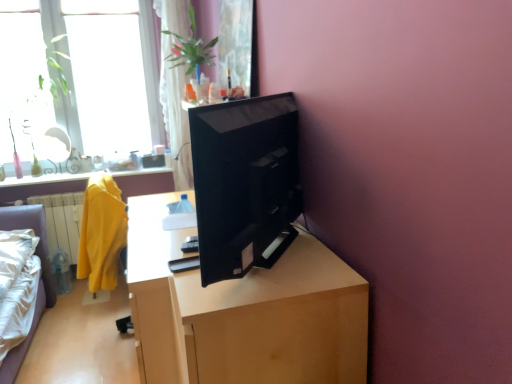
The height and width of the screenshot is (384, 512). What do you see at coordinates (244, 181) in the screenshot? I see `black glossy monitor at center` at bounding box center [244, 181].

Locate an element on the screen. yellow fabric at left is located at coordinates (62, 221).

This screenshot has width=512, height=384. What do you see at coordinates (62, 221) in the screenshot?
I see `yellow fabric at left` at bounding box center [62, 221].

This screenshot has height=384, width=512. Identify the location of matte yellow robe at left. (101, 233).

The height and width of the screenshot is (384, 512). What do you see at coordinates (243, 312) in the screenshot? I see `wooden desk at center` at bounding box center [243, 312].

This screenshot has height=384, width=512. Describe the element at coordinates (157, 81) in the screenshot. I see `transparent glass window at upper left` at that location.

Where is `black glossy monitor at center`? This screenshot has width=512, height=384. black glossy monitor at center is located at coordinates (244, 181).

From a real-world perspective, is white sheer curtain at upper center on top of matte yellow robe at left?

Indeed, from a real-world perspective, white sheer curtain at upper center stands above matte yellow robe at left.

How much distance is there between white sheer curtain at upper center and matte yellow robe at left?

The distance of white sheer curtain at upper center from matte yellow robe at left is 3.32 feet.

Is white sheer curtain at upper center shorter than matte yellow robe at left?

No.

In the scene shown: Can you confirm if white sheer curtain at upper center is wider than matte yellow robe at left?

No, white sheer curtain at upper center is not wider than matte yellow robe at left.

From a real-world perspective, between transparent glass window at upper left and white sheer curtain at upper center, who is vertically lower?

From a 3D spatial view, white sheer curtain at upper center is below.

Considering their positions, is transparent glass window at upper left located in front of or behind white sheer curtain at upper center?

transparent glass window at upper left is positioned farther from the viewer than white sheer curtain at upper center.

In terms of height, does transparent glass window at upper left look taller or shorter compared to white sheer curtain at upper center?

In the image, transparent glass window at upper left appears to be shorter than white sheer curtain at upper center.

From the image's perspective, is wooden desk at center above matte yellow robe at left?

No.

Based on the photo, would you say wooden desk at center is to the left or to the right of matte yellow robe at left in the picture?

Based on their positions, wooden desk at center is located to the right of matte yellow robe at left.

Consider the image. Is wooden desk at center directly adjacent to matte yellow robe at left?

No, wooden desk at center is not making contact with matte yellow robe at left.

Which of these two, wooden desk at center or matte yellow robe at left, stands taller?

wooden desk at center.

Who is smaller, matte yellow robe at left or black glossy monitor at center?

black glossy monitor at center.

Considering the positions of point (83, 273) and point (274, 132), is point (83, 273) closer or farther from the camera than point (274, 132)?

Point (83, 273) appears to be farther away from the viewer than point (274, 132).

Is matte yellow robe at left facing away from black glossy monitor at center?

No, matte yellow robe at left is not facing away from black glossy monitor at center.

From the image's perspective, relative to black glossy monitor at center, is matte yellow robe at left above or below?

Clearly, from the image's perspective, matte yellow robe at left is below black glossy monitor at center.

Does black glossy monitor at center appear on the left side of white sheer curtain at upper center?

In fact, black glossy monitor at center is to the right of white sheer curtain at upper center.

From a real-world perspective, is black glossy monitor at center positioned above or below white sheer curtain at upper center?

Clearly, from a real-world perspective, black glossy monitor at center is below white sheer curtain at upper center.

Is black glossy monitor at center oriented towards white sheer curtain at upper center?

No.

From a real-world perspective, which object stands above the other?

white sheer curtain at upper center is physically above.

Which object is positioned more to the left, yellow fabric at left or white sheer curtain at upper center?

yellow fabric at left is more to the left.

Does yellow fabric at left have a larger size compared to white sheer curtain at upper center?

No, yellow fabric at left is not bigger than white sheer curtain at upper center.

Looking at this image, from the image's perspective, is yellow fabric at left above or below white sheer curtain at upper center?

yellow fabric at left is below white sheer curtain at upper center.

I want to click on radiator behind the white sheer curtain at upper center, so click(x=62, y=221).

From the picture: Measure the distance between white sheer curtain at upper center and yellow fabric at left.

white sheer curtain at upper center and yellow fabric at left are 1.00 meters apart.

From the image's perspective, which is below, white sheer curtain at upper center or yellow fabric at left?

From the image's view, yellow fabric at left is below.

Who is shorter, white sheer curtain at upper center or yellow fabric at left?

With less height is yellow fabric at left.

Identify the location of robe that appears below the white sheer curtain at upper center (from the image's perspective). This screenshot has height=384, width=512. (101, 233).

This screenshot has width=512, height=384. I want to click on window on the left of white sheer curtain at upper center, so click(157, 81).

Considering their positions, is black glossy monitor at center positioned closer to matte yellow robe at left than wooden desk at center?

The object closer to matte yellow robe at left is wooden desk at center.

When comparing their distances from black glossy monitor at center, does matte yellow robe at left or wooden desk at center seem closer?

wooden desk at center is positioned closer to the anchor black glossy monitor at center.

Looking at the image, which one is located closer to matte yellow robe at left, transparent glass window at upper left or wooden desk at center?

The object closer to matte yellow robe at left is wooden desk at center.

Estimate the real-world distances between objects in this image. Which object is closer to white sheer curtain at upper center, matte yellow robe at left or transparent glass window at upper left?

transparent glass window at upper left is closer to white sheer curtain at upper center.

Estimate the real-world distances between objects in this image. Which object is closer to black glossy monitor at center, transparent glass window at upper left or wooden desk at center?

wooden desk at center is closer to black glossy monitor at center.

Based on their spatial positions, is yellow fabric at left or black glossy monitor at center further from white sheer curtain at upper center?

Among the two, black glossy monitor at center is located further to white sheer curtain at upper center.

Which object lies further to the anchor point transparent glass window at upper left, matte yellow robe at left or wooden desk at center?

wooden desk at center lies further to transparent glass window at upper left than the other object.

Estimate the real-world distances between objects in this image. Which object is closer to wooden desk at center, black glossy monitor at center or white sheer curtain at upper center?

black glossy monitor at center lies closer to wooden desk at center than the other object.

You are a GUI agent. You are given a task and a screenshot of the screen. Output one action in this format:
    pyautogui.click(x=<x>, y=<y>)
    Task: Click on the desk between black glossy monitor at center and yellow fabric at left in the front-back direction
    This screenshot has width=512, height=384.
    Given the screenshot: What is the action you would take?
    pyautogui.click(x=243, y=312)

Locate an element on the screen. robe between white sheer curtain at upper center and yellow fabric at left vertically is located at coordinates click(x=101, y=233).

Locate an element on the screen. Image resolution: width=512 pixels, height=384 pixels. robe between black glossy monitor at center and white sheer curtain at upper center in the front-back direction is located at coordinates (x=101, y=233).

The height and width of the screenshot is (384, 512). Find the location of `curtain between transparent glass window at upper left and matte yellow robe at left in the up-down direction`. curtain between transparent glass window at upper left and matte yellow robe at left in the up-down direction is located at coordinates (175, 117).